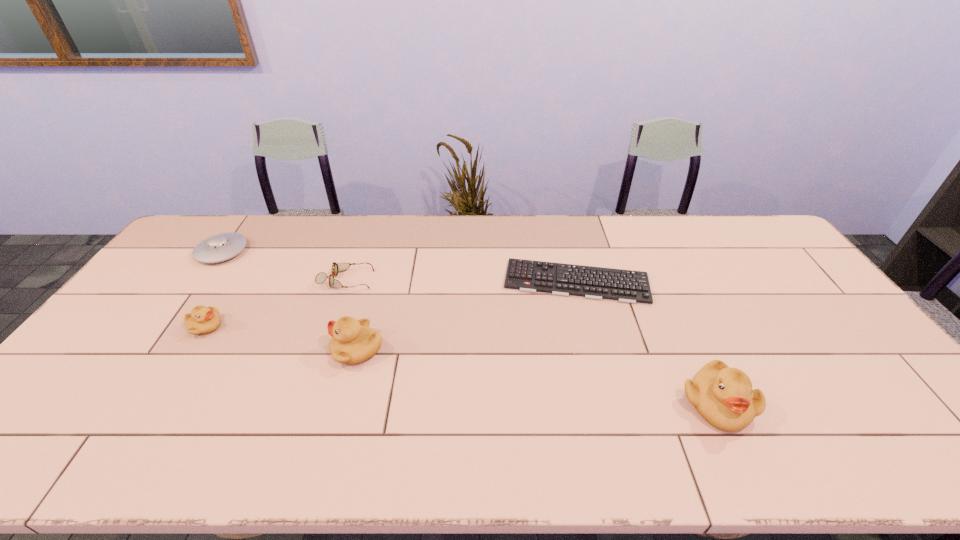
This screenshot has height=540, width=960. I want to click on vacant space that satisfies the following two spatial constraints: 1. on the front-facing side of the shortest object; 2. on the left side of the spectacles, so click(x=346, y=281).